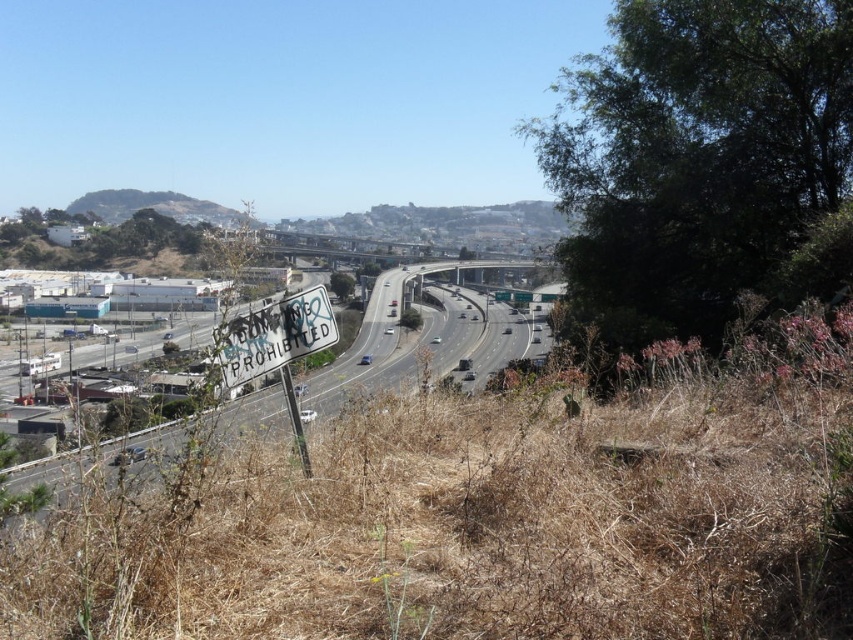
Can you confirm if white sign at center is smaller than green grassy hillside at upper left?

Actually, white sign at center might be larger than green grassy hillside at upper left.

Is point (434, 352) in front of point (88, 202)?

Yes.

The height and width of the screenshot is (640, 853). Identify the location of white sign at center. (422, 340).